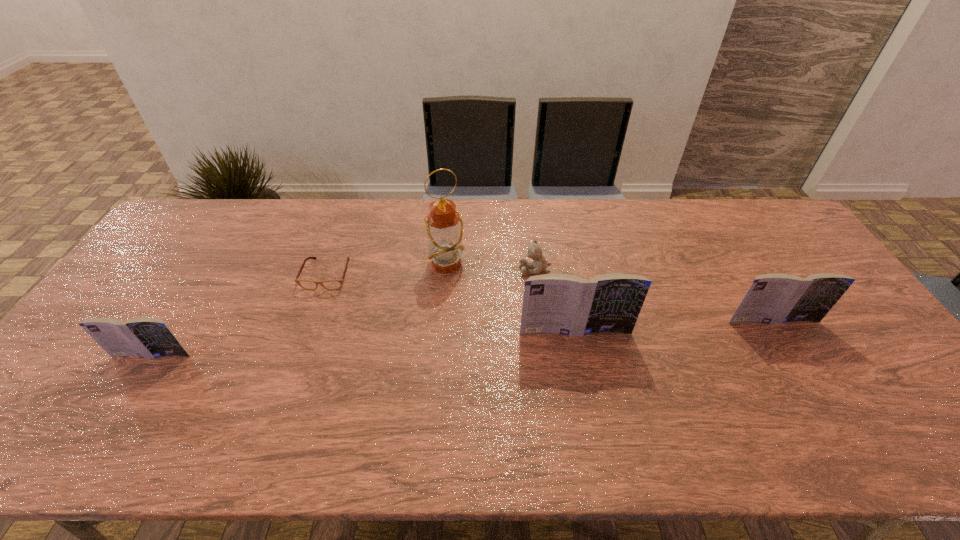
At what (x,y) coordinates should I click in order to perform the action: click on free spot between the second shortest object and the tallest object. Please return your answer as a coordinate pair (x, y). Looking at the image, I should click on (492, 266).

You are a GUI agent. You are given a task and a screenshot of the screen. Output one action in this format:
    pyautogui.click(x=<x>, y=<y>)
    Task: Click on the unoccupied position between the leftmost object and the fourth shortest object
    
    Given the screenshot: What is the action you would take?
    pyautogui.click(x=463, y=338)

This screenshot has width=960, height=540. Identify the location of blank region between the fourth tallest object and the tallest book. (364, 343).

At what (x,y) coordinates should I click in order to perform the action: click on free space that is in between the second object from left to right and the nearest book. Please return your answer as a coordinate pair (x, y). Looking at the image, I should click on (240, 315).

You are a GUI agent. You are given a task and a screenshot of the screen. Output one action in this format:
    pyautogui.click(x=<x>, y=<y>)
    Task: Click on the free space between the fourth farthest object and the third shortest object
    This screenshot has width=960, height=540.
    Given the screenshot: What is the action you would take?
    pyautogui.click(x=463, y=338)

Where is `object that is the closest to the fifth tallest object`? object that is the closest to the fifth tallest object is located at coordinates (444, 225).

You are a GUI agent. You are given a task and a screenshot of the screen. Output one action in this format:
    pyautogui.click(x=<x>, y=<y>)
    Task: Click on the object identified as the fifth closest to the nearest book
    This screenshot has width=960, height=540.
    Given the screenshot: What is the action you would take?
    pyautogui.click(x=774, y=298)

You are a GUI agent. You are given a task and a screenshot of the screen. Output one action in this format:
    pyautogui.click(x=<x>, y=<y>)
    Task: Click on the second closest book relative to the teddy bear
    The image size is (960, 540).
    Given the screenshot: What is the action you would take?
    pyautogui.click(x=774, y=298)

In order to click on book that stands as the third closest to the spectacles in this screenshot , I will do `click(774, 298)`.

At what (x,y) coordinates should I click in order to perform the action: click on free spot that satisfies the following two spatial constraints: 1. on the face of the fifth tallest object; 2. on the front-facing side of the fifth object from right to left. Please return your answer as a coordinate pair (x, y). Looking at the image, I should click on (536, 274).